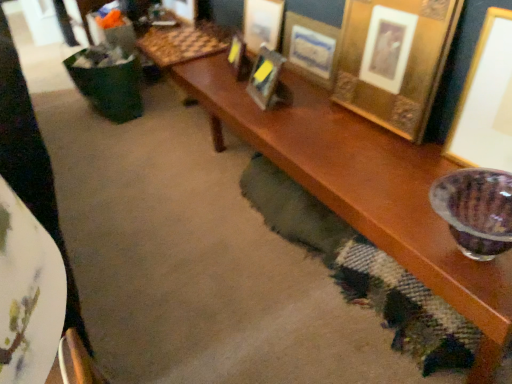
Describe the element at coordinates (265, 77) in the screenshot. I see `gold metallic picture frame at upper center, arranged as the third picture frame when viewed from the left` at that location.

Locate an element on the screen. gold metallic picture frame at upper center, the 1th picture frame when ordered from left to right is located at coordinates (238, 57).

Identify the location of gold textured picture frame at upper right, the second picture frame from the right. (394, 60).

How much space does gold metallic picture frame at upper right, which appears as the 4th picture frame when viewed from the left, occupy horizontally?

It is 4.80 centimeters.

The height and width of the screenshot is (384, 512). What do you see at coordinates (486, 100) in the screenshot? I see `gold metallic picture frame at upper right, acting as the first picture frame starting from the right` at bounding box center [486, 100].

Measure the distance between gold metallic picture frame at upper right, acting as the first picture frame starting from the right, and camera.

gold metallic picture frame at upper right, acting as the first picture frame starting from the right, is 3.34 feet away from camera.

Locate an element on the screen. The width and height of the screenshot is (512, 384). gold metallic picture frame at upper center, arranged as the third picture frame when viewed from the left is located at coordinates (265, 77).

Are gold metallic picture frame at upper center, arranged as the second picture frame when viewed from the left, and gold metallic picture frame at upper right, which appears as the 3th picture frame when viewed from the right, beside each other?

No, gold metallic picture frame at upper center, arranged as the second picture frame when viewed from the left, is not in contact with gold metallic picture frame at upper right, which appears as the 3th picture frame when viewed from the right.

From the image's perspective, is gold metallic picture frame at upper center, arranged as the second picture frame when viewed from the left, located above or below gold metallic picture frame at upper right, which appears as the 3th picture frame when viewed from the right?

Clearly, from the image's perspective, gold metallic picture frame at upper center, arranged as the second picture frame when viewed from the left, is above gold metallic picture frame at upper right, which appears as the 3th picture frame when viewed from the right.

Considering the sizes of objects gold metallic picture frame at upper right, which ranks as the 6th picture frame in left-to-right order, and gold textured picture frame at upper right, the second picture frame from the right, in the image provided, who is bigger, gold metallic picture frame at upper right, which ranks as the 6th picture frame in left-to-right order, or gold textured picture frame at upper right, the second picture frame from the right,?

gold textured picture frame at upper right, the second picture frame from the right, is bigger.

Considering the points (506, 100) and (384, 27), which point is behind, point (506, 100) or point (384, 27)?

The point (384, 27) is farther from the camera.

From the image's perspective, relative to gold textured picture frame at upper right, which appears as the fifth picture frame when viewed from the left, is gold metallic picture frame at upper right, which ranks as the 6th picture frame in left-to-right order, above or below?

gold metallic picture frame at upper right, which ranks as the 6th picture frame in left-to-right order, is below gold textured picture frame at upper right, which appears as the fifth picture frame when viewed from the left.

From a real-world perspective, which is physically below, gold metallic picture frame at upper right, acting as the first picture frame starting from the right, or gold textured picture frame at upper right, the second picture frame from the right?

gold textured picture frame at upper right, the second picture frame from the right, is physically lower.

Which is more to the right, gold textured picture frame at upper right, which appears as the fifth picture frame when viewed from the left, or gold metallic picture frame at upper center, arranged as the third picture frame when viewed from the left?

gold textured picture frame at upper right, which appears as the fifth picture frame when viewed from the left.

Which is more distant, (417, 23) or (261, 79)?

The point (261, 79) is more distant.

The width and height of the screenshot is (512, 384). Find the location of `the 1st picture frame below the gold metallic picture frame at upper center, the 4th picture frame in the right-to-left sequence (from the image's perspective)`. the 1st picture frame below the gold metallic picture frame at upper center, the 4th picture frame in the right-to-left sequence (from the image's perspective) is located at coordinates (394, 60).

Would you say gold textured picture frame at upper right, the second picture frame from the right, is inside or outside gold metallic picture frame at upper center, arranged as the third picture frame when viewed from the left?

gold textured picture frame at upper right, the second picture frame from the right, is outside gold metallic picture frame at upper center, arranged as the third picture frame when viewed from the left.

Can you confirm if gold metallic picture frame at upper center, the 1th picture frame when ordered from left to right, is positioned to the left of gold metallic picture frame at upper right, which ranks as the 6th picture frame in left-to-right order?

Yes, gold metallic picture frame at upper center, the 1th picture frame when ordered from left to right, is to the left of gold metallic picture frame at upper right, which ranks as the 6th picture frame in left-to-right order.

From a real-world perspective, is gold metallic picture frame at upper center, the 1th picture frame when ordered from left to right, physically above gold metallic picture frame at upper right, which ranks as the 6th picture frame in left-to-right order?

No.

Considering the sizes of objects gold metallic picture frame at upper center, which ranks as the 6th picture frame in right-to-left order, and gold metallic picture frame at upper right, acting as the first picture frame starting from the right, in the image provided, who is wider, gold metallic picture frame at upper center, which ranks as the 6th picture frame in right-to-left order, or gold metallic picture frame at upper right, acting as the first picture frame starting from the right,?

With larger width is gold metallic picture frame at upper right, acting as the first picture frame starting from the right.

Is gold metallic picture frame at upper center, arranged as the second picture frame when viewed from the left, to the right of gold textured picture frame at upper right, which appears as the fifth picture frame when viewed from the left, from the viewer's perspective?

In fact, gold metallic picture frame at upper center, arranged as the second picture frame when viewed from the left, is to the left of gold textured picture frame at upper right, which appears as the fifth picture frame when viewed from the left.

Is gold metallic picture frame at upper center, which appears as the 5th picture frame when viewed from the right, next to gold textured picture frame at upper right, the second picture frame from the right, and touching it?

No.

From the image's perspective, is gold metallic picture frame at upper center, arranged as the second picture frame when viewed from the left, located beneath gold textured picture frame at upper right, which appears as the fifth picture frame when viewed from the left?

Actually, gold metallic picture frame at upper center, arranged as the second picture frame when viewed from the left, appears above gold textured picture frame at upper right, which appears as the fifth picture frame when viewed from the left, in the image.

Is gold metallic picture frame at upper right, which appears as the 3th picture frame when viewed from the right, wider than white fabric at lower left?

Incorrect, the width of gold metallic picture frame at upper right, which appears as the 3th picture frame when viewed from the right, does not surpass that of white fabric at lower left.

From the image's perspective, which one is positioned lower, gold metallic picture frame at upper right, which appears as the 4th picture frame when viewed from the left, or white fabric at lower left?

white fabric at lower left.

Considering the positions of objects gold metallic picture frame at upper right, which appears as the 3th picture frame when viewed from the right, and white fabric at lower left in the image provided, who is in front, gold metallic picture frame at upper right, which appears as the 3th picture frame when viewed from the right, or white fabric at lower left?

white fabric at lower left is closer to the camera.

Would you say gold metallic picture frame at upper right, which appears as the 3th picture frame when viewed from the right, is outside white fabric at lower left?

gold metallic picture frame at upper right, which appears as the 3th picture frame when viewed from the right, lies outside white fabric at lower left's area.

From a real-world perspective, between gold metallic picture frame at upper right, which ranks as the 6th picture frame in left-to-right order, and white fabric at lower left, who is vertically higher?

white fabric at lower left is physically above.

Which object is positioned more to the left, gold metallic picture frame at upper right, which ranks as the 6th picture frame in left-to-right order, or white fabric at lower left?

From the viewer's perspective, white fabric at lower left appears more on the left side.

Is gold metallic picture frame at upper right, which ranks as the 6th picture frame in left-to-right order, taller or shorter than white fabric at lower left?

gold metallic picture frame at upper right, which ranks as the 6th picture frame in left-to-right order, is taller than white fabric at lower left.

From the image's perspective, does gold metallic picture frame at upper right, which ranks as the 6th picture frame in left-to-right order, appear lower than white fabric at lower left?

No, from the image's perspective, gold metallic picture frame at upper right, which ranks as the 6th picture frame in left-to-right order, is not below white fabric at lower left.

Identify the location of the 1st picture frame positioned below the gold metallic picture frame at upper center, arranged as the second picture frame when viewed from the left (from a real-world perspective). (311, 48).

You are a GUI agent. You are given a task and a screenshot of the screen. Output one action in this format:
    pyautogui.click(x=<x>, y=<y>)
    Task: Click on the picture frame above the gold textured picture frame at upper right, which appears as the fifth picture frame when viewed from the left (from a real-world perspective)
    Image resolution: width=512 pixels, height=384 pixels.
    Given the screenshot: What is the action you would take?
    pyautogui.click(x=486, y=100)

When comparing their distances from gold metallic picture frame at upper center, arranged as the third picture frame when viewed from the left, does gold textured picture frame at upper right, which appears as the fifth picture frame when viewed from the left, or gold metallic picture frame at upper center, which ranks as the 6th picture frame in right-to-left order, seem further?

Among the two, gold textured picture frame at upper right, which appears as the fifth picture frame when viewed from the left, is located further to gold metallic picture frame at upper center, arranged as the third picture frame when viewed from the left.

Which object lies further to the anchor point gold metallic picture frame at upper right, which appears as the 4th picture frame when viewed from the left, white fabric at lower left or gold metallic picture frame at upper center, arranged as the third picture frame when viewed from the left?

white fabric at lower left is positioned further to the anchor gold metallic picture frame at upper right, which appears as the 4th picture frame when viewed from the left.

Considering their positions, is gold metallic picture frame at upper center, the 1th picture frame when ordered from left to right, positioned closer to gold textured picture frame at upper right, which appears as the fifth picture frame when viewed from the left, than gold metallic picture frame at upper center, arranged as the second picture frame when viewed from the left?

The object closer to gold textured picture frame at upper right, which appears as the fifth picture frame when viewed from the left, is gold metallic picture frame at upper center, arranged as the second picture frame when viewed from the left.

Based on their spatial positions, is gold metallic picture frame at upper center, the 4th picture frame in the right-to-left sequence, or gold metallic picture frame at upper right, which appears as the 4th picture frame when viewed from the left, further from gold metallic picture frame at upper center, which appears as the 5th picture frame when viewed from the right?

gold metallic picture frame at upper center, the 4th picture frame in the right-to-left sequence, lies further to gold metallic picture frame at upper center, which appears as the 5th picture frame when viewed from the right, than the other object.

Based on their spatial positions, is gold textured picture frame at upper right, the second picture frame from the right, or gold metallic picture frame at upper right, which appears as the 4th picture frame when viewed from the left, closer to white fabric at lower left?

gold textured picture frame at upper right, the second picture frame from the right.

Which object lies further to the anchor point gold metallic picture frame at upper center, arranged as the third picture frame when viewed from the left, gold metallic picture frame at upper center, the 1th picture frame when ordered from left to right, or gold metallic picture frame at upper center, arranged as the second picture frame when viewed from the left?

gold metallic picture frame at upper center, arranged as the second picture frame when viewed from the left, lies further to gold metallic picture frame at upper center, arranged as the third picture frame when viewed from the left, than the other object.

Looking at the image, which one is located closer to gold metallic picture frame at upper right, which ranks as the 6th picture frame in left-to-right order, gold metallic picture frame at upper center, arranged as the second picture frame when viewed from the left, or gold metallic picture frame at upper center, the 4th picture frame in the right-to-left sequence?

Based on the image, gold metallic picture frame at upper center, the 4th picture frame in the right-to-left sequence, appears to be nearer to gold metallic picture frame at upper right, which ranks as the 6th picture frame in left-to-right order.

Estimate the real-world distances between objects in this image. Which object is closer to white fabric at lower left, gold metallic picture frame at upper center, arranged as the second picture frame when viewed from the left, or gold metallic picture frame at upper center, arranged as the third picture frame when viewed from the left?

gold metallic picture frame at upper center, arranged as the third picture frame when viewed from the left, is positioned closer to the anchor white fabric at lower left.

Find the location of `picture frame positioned between white fabric at lower left and gold textured picture frame at upper right, which appears as the fifth picture frame when viewed from the left, from near to far`. picture frame positioned between white fabric at lower left and gold textured picture frame at upper right, which appears as the fifth picture frame when viewed from the left, from near to far is located at coordinates (486, 100).

Locate an element on the screen. picture frame between gold metallic picture frame at upper right, which ranks as the 6th picture frame in left-to-right order, and gold metallic picture frame at upper center, the 4th picture frame in the right-to-left sequence, from front to back is located at coordinates (394, 60).

This screenshot has width=512, height=384. In order to click on picture frame positioned between gold textured picture frame at upper right, the second picture frame from the right, and gold metallic picture frame at upper right, which appears as the 4th picture frame when viewed from the left, from near to far in this screenshot , I will do `click(265, 77)`.